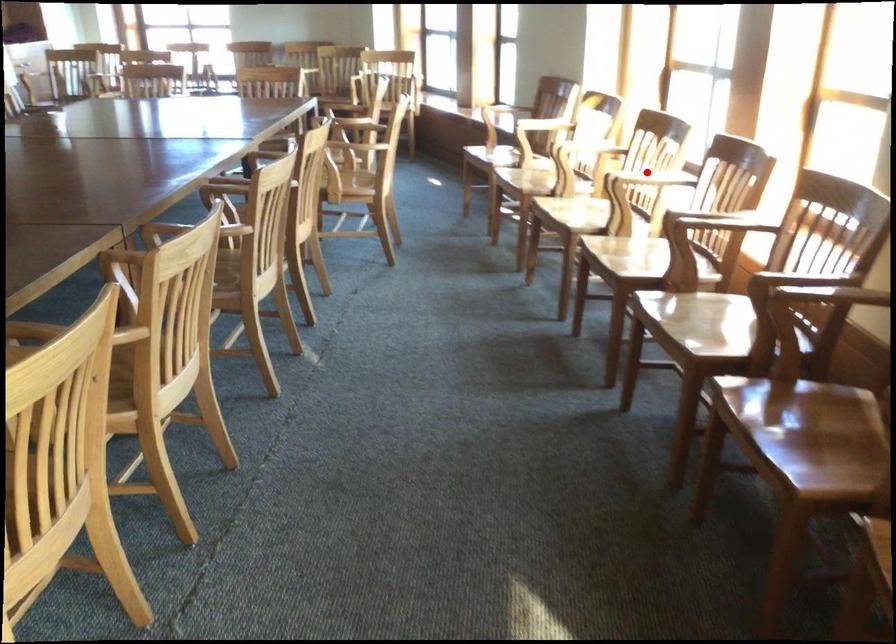
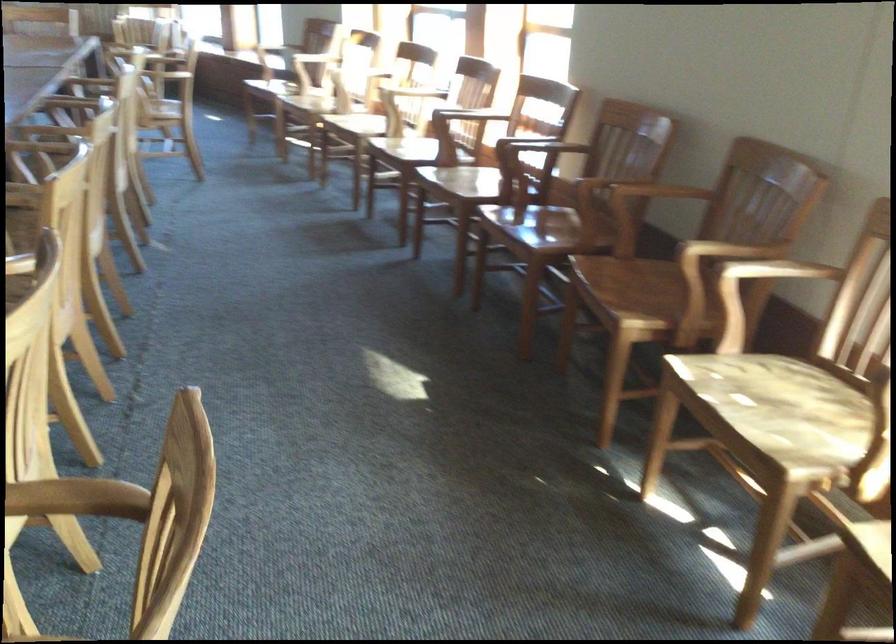
Where in the second image is the point corresponding to the highlighted location from the first image?

(410, 91)